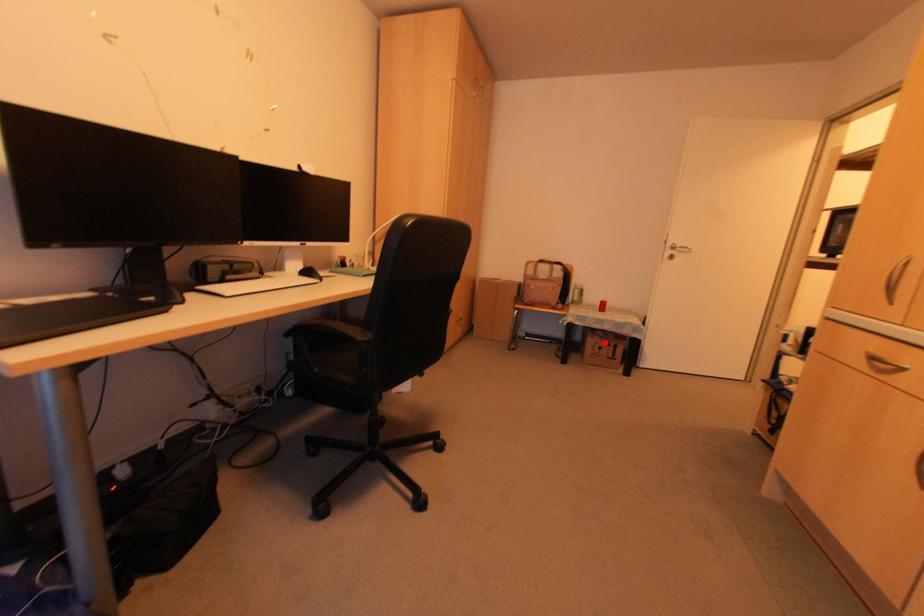
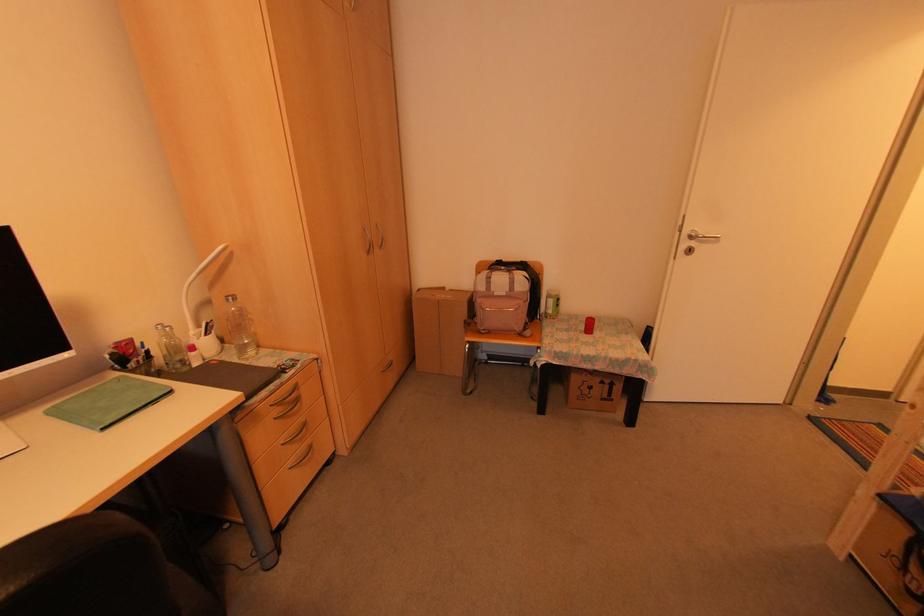
Where in the second image is the point corresponding to the highlighted location from the first image?

(598, 381)